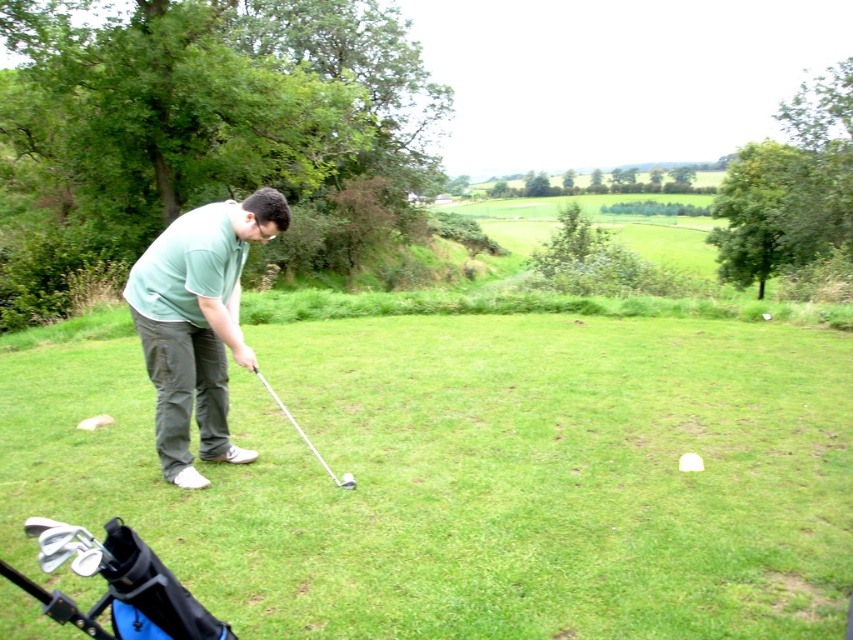
Between green grass at center and metallic silver golf club at center, which one appears on the left side from the viewer's perspective?

metallic silver golf club at center

In the scene shown: Between green grass at center and metallic silver golf club at center, which one has less height?

metallic silver golf club at center

Is point (405, 593) farther from viewer compared to point (332, 474)?

No, it is not.

Image resolution: width=853 pixels, height=640 pixels. What are the coordinates of `green grass at center` in the screenshot? It's located at (471, 476).

In the scene shown: Who is higher up, white matte golf at center or shiny silver golf club at center?

white matte golf at center is higher up.

Between white matte golf at center and shiny silver golf club at center, which one appears on the left side from the viewer's perspective?

Positioned to the left is shiny silver golf club at center.

Is point (689, 467) farther from camera compared to point (347, 486)?

Yes, it is.

Locate an element on the screen. white matte golf at center is located at coordinates (689, 461).

Which is in front, point (248, 506) or point (247, 243)?

Point (248, 506)

Does green grass at center have a lesser width compared to green matte shirt at center?

In fact, green grass at center might be wider than green matte shirt at center.

Where is `green grass at center`? This screenshot has width=853, height=640. green grass at center is located at coordinates tap(471, 476).

I want to click on green grass at center, so click(x=471, y=476).